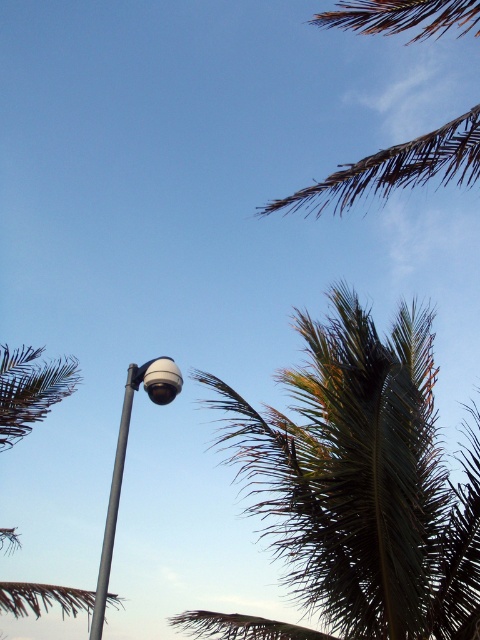
Question: Which object is farther from the camera taking this photo?

Choices:
 (A) sleek metallic street light at upper center
 (B) green leafy palm tree at upper right
 (C) brown/dry palm leaf at upper right
 (D) metallic gray pole at center

Answer: (C)

Question: Can you confirm if green leafy palm tree at upper right is positioned to the right of green leafy palm at upper left?

Choices:
 (A) no
 (B) yes

Answer: (B)

Question: Does brown/dry palm leaf at upper right come behind metallic gray pole at center?

Choices:
 (A) yes
 (B) no

Answer: (A)

Question: Which is farther from the brown/dry palm leaf at upper right?

Choices:
 (A) green leafy palm at upper left
 (B) green leafy palm tree at upper right
 (C) sleek metallic street light at upper center
 (D) metallic gray pole at center

Answer: (A)

Question: Can you confirm if green leafy palm tree at upper right is wider than green leafy palm at upper left?

Choices:
 (A) no
 (B) yes

Answer: (B)

Question: Which object appears closest to the camera in this image?

Choices:
 (A) brown/dry palm leaf at upper right
 (B) sleek metallic street light at upper center
 (C) metallic gray pole at center
 (D) green leafy palm at upper left

Answer: (B)